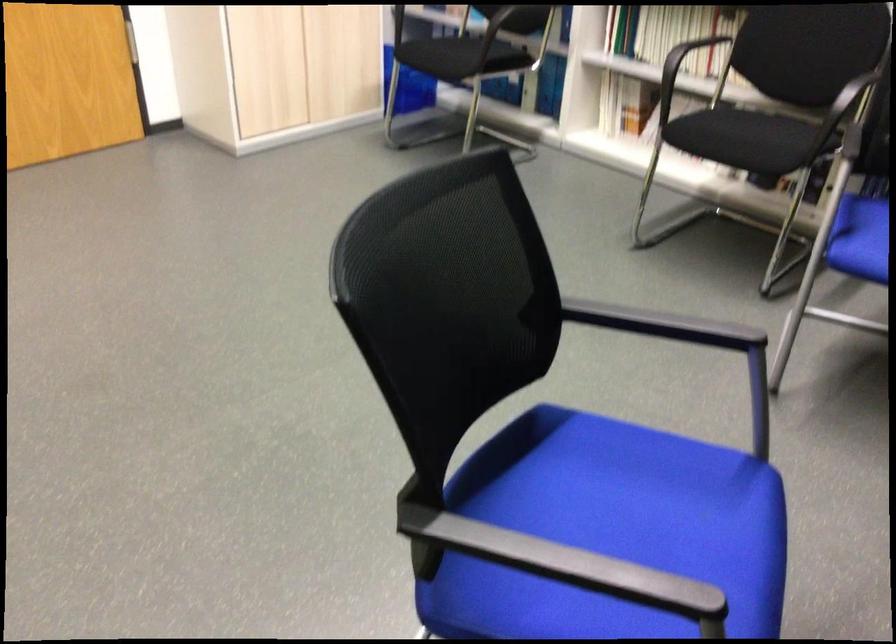
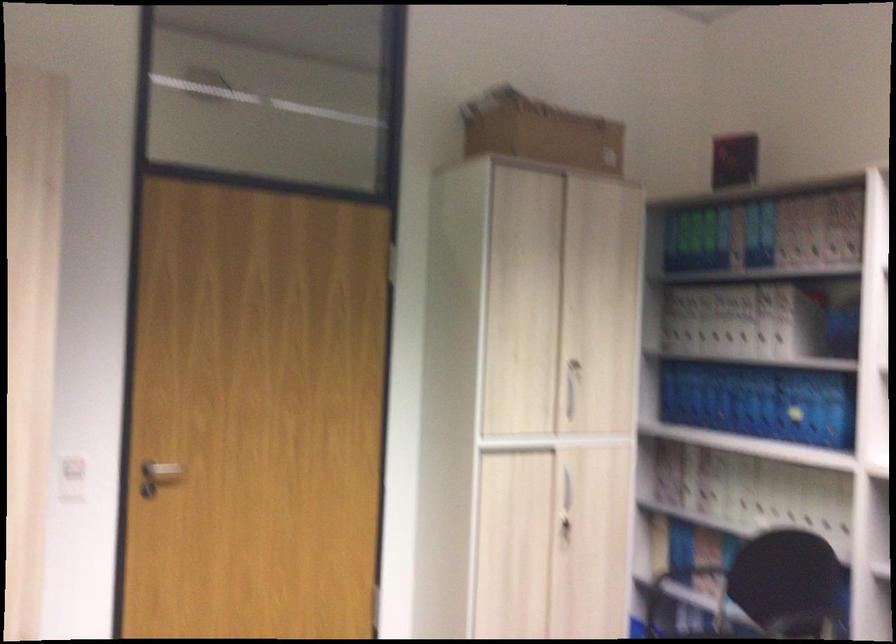
The first image is from the beginning of the video and the second image is from the end. How did the camera likely rotate when shooting the video?

The camera rotated toward left-up.